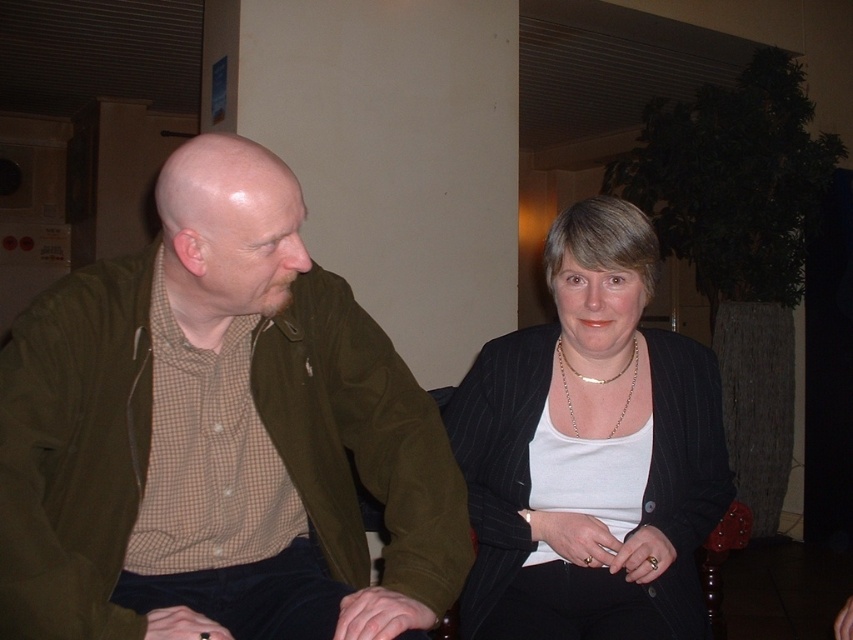
Question: Among these objects, which one is nearest to the camera?

Choices:
 (A) matte olive green jacket at left
 (B) white pinstripe blazer at center

Answer: (A)

Question: Among these objects, which one is nearest to the camera?

Choices:
 (A) matte olive green jacket at left
 (B) gold chain necklace at center
 (C) white pinstripe blazer at center

Answer: (A)

Question: Is white pinstripe blazer at center thinner than gold chain necklace at center?

Choices:
 (A) no
 (B) yes

Answer: (A)

Question: Does matte olive green jacket at left have a greater width compared to white pinstripe blazer at center?

Choices:
 (A) yes
 (B) no

Answer: (A)

Question: Which object appears farthest from the camera in this image?

Choices:
 (A) white pinstripe blazer at center
 (B) gold chain necklace at center
 (C) matte olive green jacket at left

Answer: (B)

Question: Where is matte olive green jacket at left located in relation to white pinstripe blazer at center in the image?

Choices:
 (A) left
 (B) right

Answer: (A)